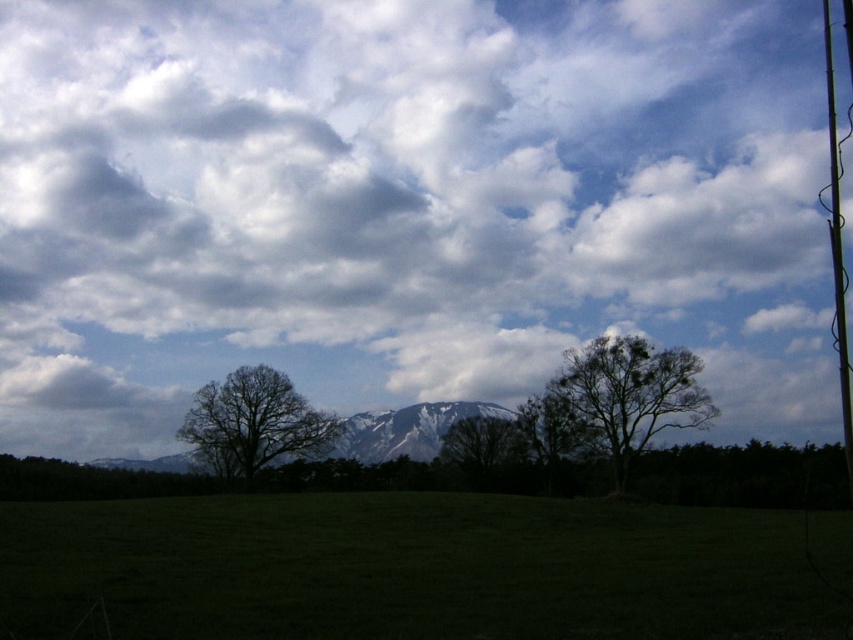
You are an artist planning to sketch the scene. You notice the bare branches tree at center and the metallic wire at right. Which object should you draw first if you want to capture the narrower object first?

The bare branches tree at center should be drawn first because its width is narrower than the metallic wire at right.

You are standing in the open grassland looking at the scene. There is a point marked at coordinates point (404,205). What is the object located at this point?

The point (404,205) marks cloudy sky at upper center.

In the scene shown: You are a bird soaring over the open grassland. You want to land on the dark brown bark tree at right but need to avoid flying through the cloudy sky at upper center. Which object is wider so you can navigate around it?

The cloudy sky at upper center is wider than the dark brown bark tree at right, so you should navigate around the cloudy sky at upper center as it has a greater width.